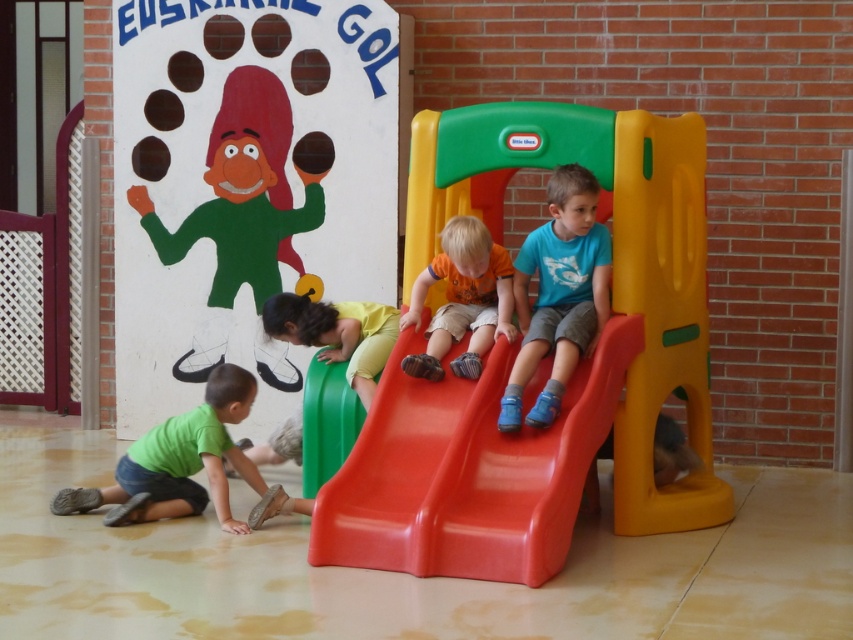
You are a parent trying to ensure your child can move safely between the matte plastic slide at center and the blue matte shirt at center. Based on their sizes, can you estimate if there is enough space for the child to pass through the gap between them?

The matte plastic slide at center might be wider than blue matte shirt at center, so there may not be enough space for the child to pass safely. It is advisable to check the actual dimensions before allowing the child to move between them.

You are a parent supervising children in the play area. You notice the orange matte shirt at center and the yellow matte slide at lower center. Which object is taller?

The orange matte shirt at center is taller than the yellow matte slide at lower center.